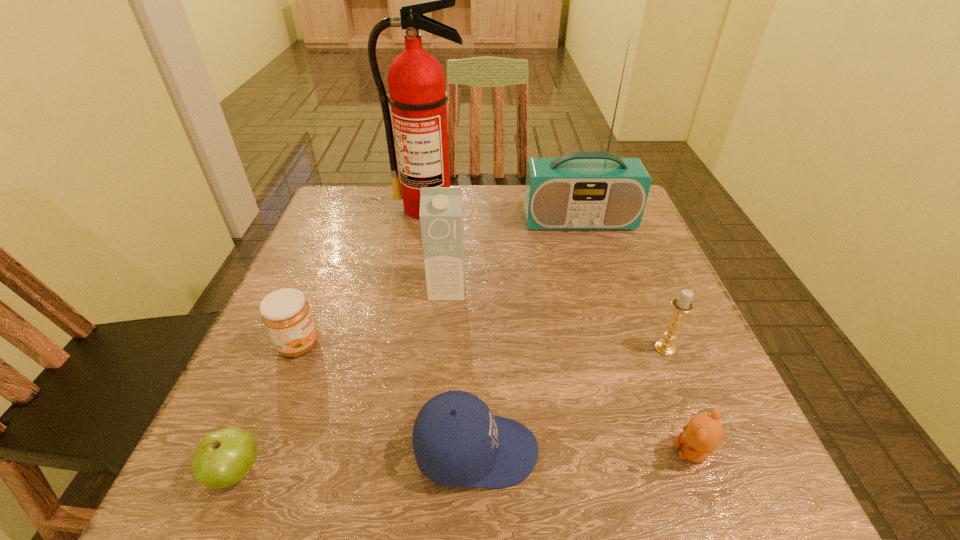
The height and width of the screenshot is (540, 960). Identify the location of fire extinguisher. (417, 94).

Identify the location of the second tallest object. pyautogui.click(x=580, y=190).

Locate an element on the screen. This screenshot has height=540, width=960. carton is located at coordinates (441, 208).

Locate an element on the screen. The height and width of the screenshot is (540, 960). the sixth shortest object is located at coordinates (441, 208).

Where is `the fourth tallest object`? The height and width of the screenshot is (540, 960). the fourth tallest object is located at coordinates (682, 305).

I want to click on jam, so click(x=286, y=314).

The width and height of the screenshot is (960, 540). Find the location of `cap`. cap is located at coordinates (457, 441).

At what (x,y) coordinates should I click in order to perform the action: click on teddy bear. Please return your answer as a coordinate pair (x, y). This screenshot has width=960, height=540. Looking at the image, I should click on (703, 434).

Locate an element on the screen. Image resolution: width=960 pixels, height=540 pixels. apple is located at coordinates (224, 457).

You are a GUI agent. You are given a task and a screenshot of the screen. Output one action in this format:
    pyautogui.click(x=<x>, y=<y>)
    Task: Click on the free space located on the side of the fire extinguisher near the handle
    The width and height of the screenshot is (960, 540).
    Given the screenshot: What is the action you would take?
    pyautogui.click(x=413, y=303)